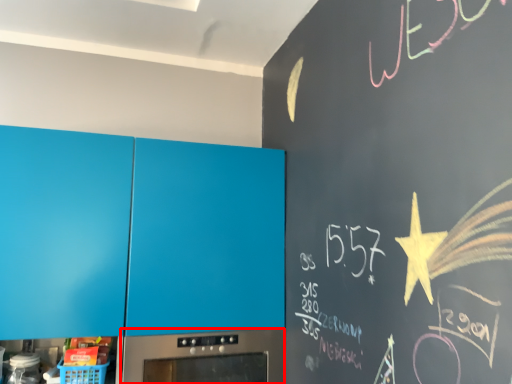
Question: In this image, where is home appliance (annotated by the red box) located relative to cabinetry?

Choices:
 (A) left
 (B) right

Answer: (B)